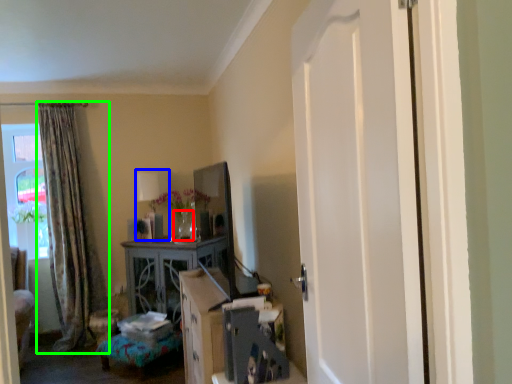
Question: Considering the real-world distances, which object is closest to vase (highlighted by a red box)? lamp (highlighted by a blue box) or curtain (highlighted by a green box).

Choices:
 (A) lamp
 (B) curtain

Answer: (A)